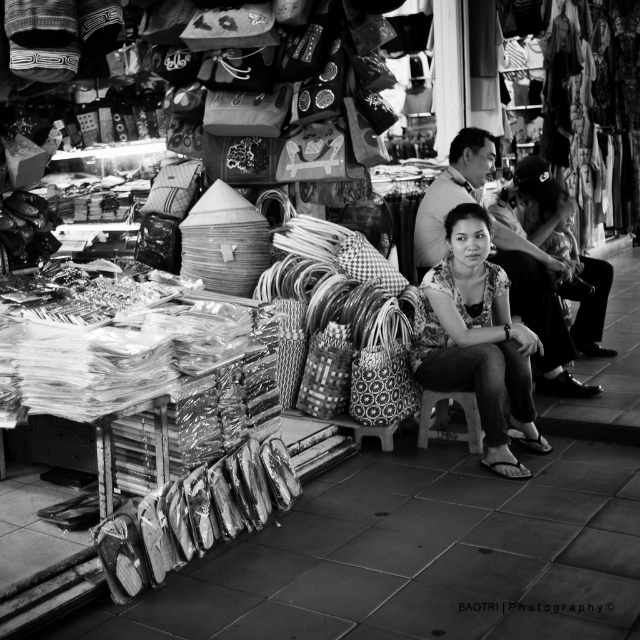
Question: Is printed fabric blouse at center above wooden stool at center?

Choices:
 (A) yes
 (B) no

Answer: (A)

Question: Is smooth leather jacket at center thinner than wooden stool at center?

Choices:
 (A) no
 (B) yes

Answer: (A)

Question: Does printed fabric blouse at center have a larger size compared to wooden stool at center?

Choices:
 (A) no
 (B) yes

Answer: (B)

Question: Which point appears farthest from the camera in this image?

Choices:
 (A) (545, 294)
 (B) (426, 394)
 (C) (461, 264)

Answer: (A)

Question: Which point is farther to the camera?

Choices:
 (A) wooden stool at center
 (B) printed fabric blouse at center
 (C) smooth leather jacket at center

Answer: (C)

Question: Which object is closer to the camera taking this photo?

Choices:
 (A) wooden stool at center
 (B) printed fabric blouse at center
 (C) smooth leather jacket at center

Answer: (B)